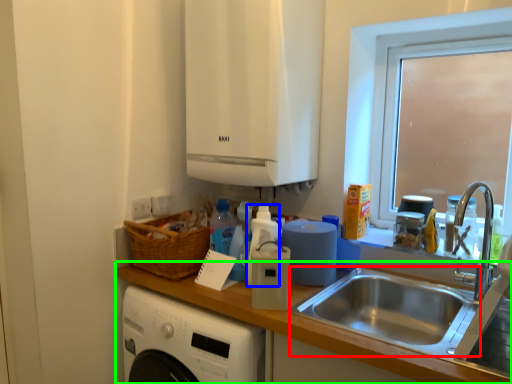
Question: Which object is the closest to the sink (highlighted by a red box)? Choose among these: bottle (highlighted by a blue box) or countertop (highlighted by a green box).

Choices:
 (A) bottle
 (B) countertop

Answer: (B)